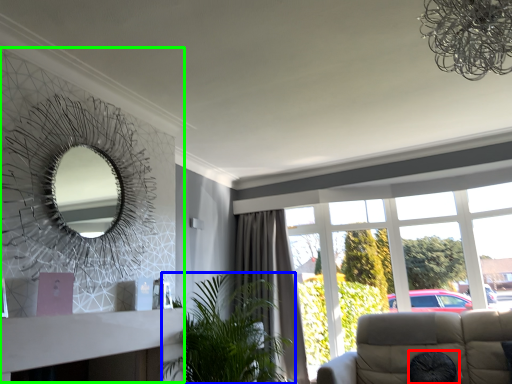
Question: Considering the real-world distances, which object is closest to oval (highlighted by a red box)? houseplant (highlighted by a blue box) or fireplace (highlighted by a green box).

Choices:
 (A) houseplant
 (B) fireplace

Answer: (A)